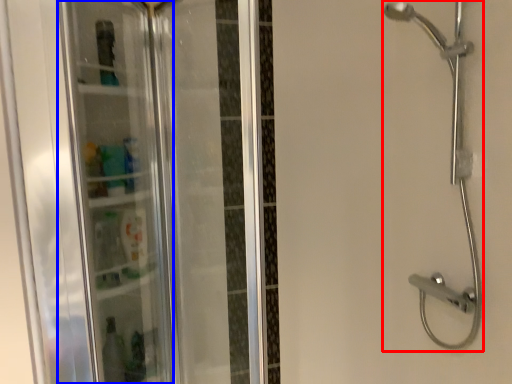
Question: Which point is further to the camera, shower (highlighted by a red box) or screen door (highlighted by a blue box)?

Choices:
 (A) shower
 (B) screen door

Answer: (A)